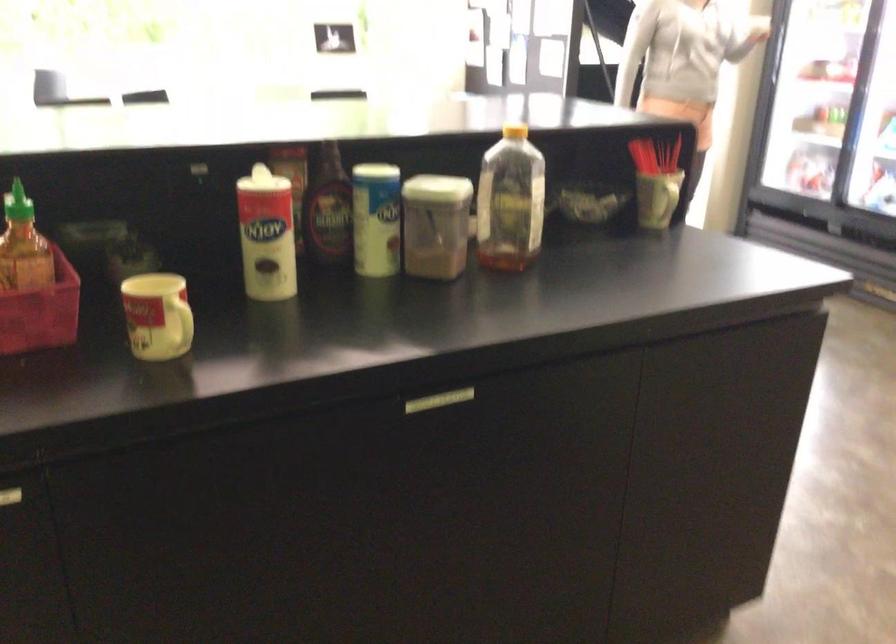
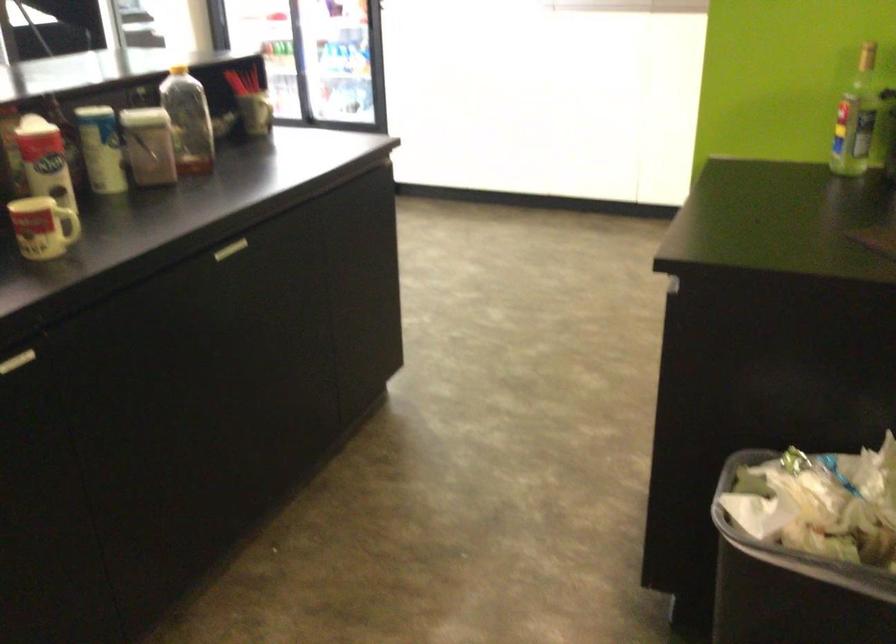
Find the pixel in the second image that matches (x=426, y=399) in the first image.

(229, 249)